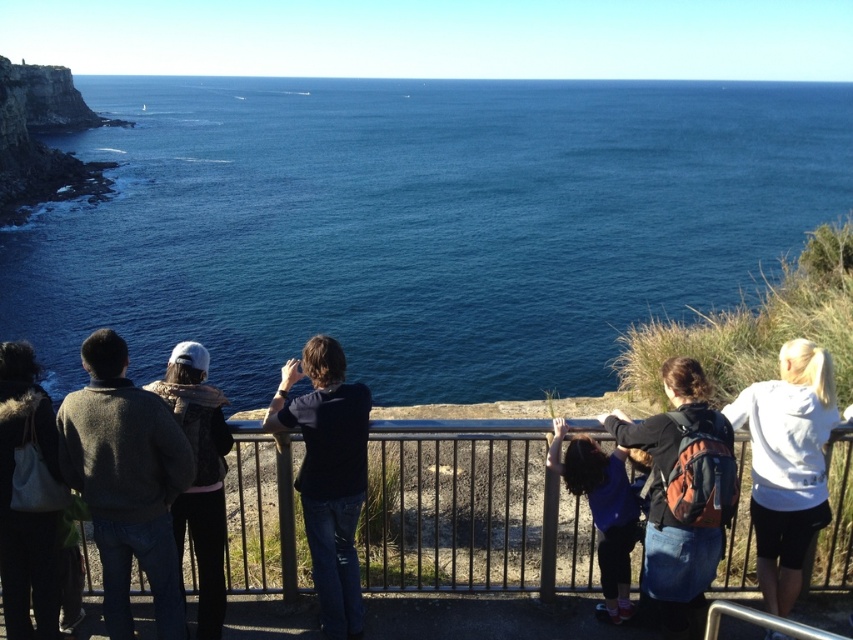
Question: Which point is closer to the camera?

Choices:
 (A) white fur-trimmed coat at left
 (B) blue fabric at center

Answer: (A)

Question: Does blue water at center appear on the left side of white fur-trimmed coat at left?

Choices:
 (A) yes
 (B) no

Answer: (B)

Question: Which of the following is the farthest from the observer?

Choices:
 (A) (779, 612)
 (B) (76, 456)

Answer: (A)

Question: Which point is farther to the camera?

Choices:
 (A) (525, 552)
 (B) (567, 218)
 (C) (189, 502)
 (D) (109, 556)

Answer: (B)

Question: Is blue water at center further to camera compared to metallic gray railing at center?

Choices:
 (A) yes
 (B) no

Answer: (A)

Question: Can you confirm if dark blue shirt at center is smaller than blue fabric at center?

Choices:
 (A) no
 (B) yes

Answer: (B)